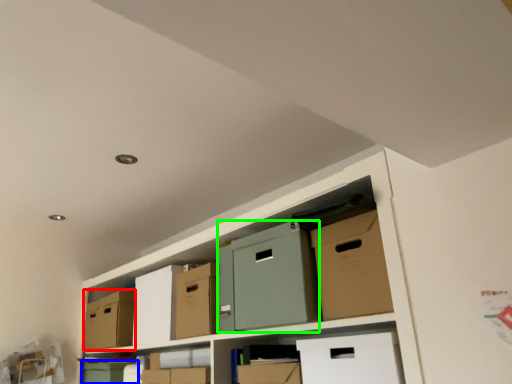
Question: Considering the real-world distances, which object is closest to cardboard box (highlighted by a red box)? box (highlighted by a blue box) or wide (highlighted by a green box).

Choices:
 (A) box
 (B) wide

Answer: (A)